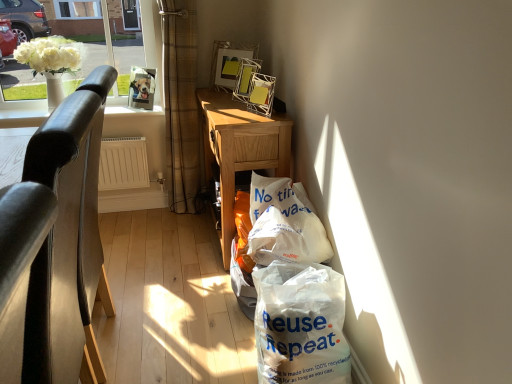
Question: Is white plastic bag at lower right outside wooden desk at center?

Choices:
 (A) no
 (B) yes

Answer: (B)

Question: Could you tell me if white plastic bag at lower right is facing wooden desk at center?

Choices:
 (A) no
 (B) yes

Answer: (A)

Question: From a real-world perspective, is white plastic bag at lower right under wooden desk at center?

Choices:
 (A) no
 (B) yes

Answer: (B)

Question: From a real-world perspective, is white plastic bag at lower right positioned over wooden desk at center based on gravity?

Choices:
 (A) no
 (B) yes

Answer: (A)

Question: Can you confirm if white plastic bag at lower right is positioned to the right of wooden desk at center?

Choices:
 (A) yes
 (B) no

Answer: (A)

Question: Is white plastic bag at lower right in contact with wooden desk at center?

Choices:
 (A) yes
 (B) no

Answer: (B)

Question: Does black leather chair at left have a greater height compared to brown plaid curtain at upper left?

Choices:
 (A) yes
 (B) no

Answer: (B)

Question: From a real-world perspective, is black leather chair at left below brown plaid curtain at upper left?

Choices:
 (A) no
 (B) yes

Answer: (B)

Question: Is the position of black leather chair at left more distant than that of brown plaid curtain at upper left?

Choices:
 (A) yes
 (B) no

Answer: (B)

Question: Considering the relative sizes of black leather chair at left and brown plaid curtain at upper left in the image provided, is black leather chair at left shorter than brown plaid curtain at upper left?

Choices:
 (A) no
 (B) yes

Answer: (B)

Question: Is black leather chair at left turned away from brown plaid curtain at upper left?

Choices:
 (A) yes
 (B) no

Answer: (B)

Question: Is black leather chair at left facing towards brown plaid curtain at upper left?

Choices:
 (A) no
 (B) yes

Answer: (A)

Question: Can you confirm if metallic wire picture frame at upper center is bigger than wooden desk at center?

Choices:
 (A) no
 (B) yes

Answer: (A)